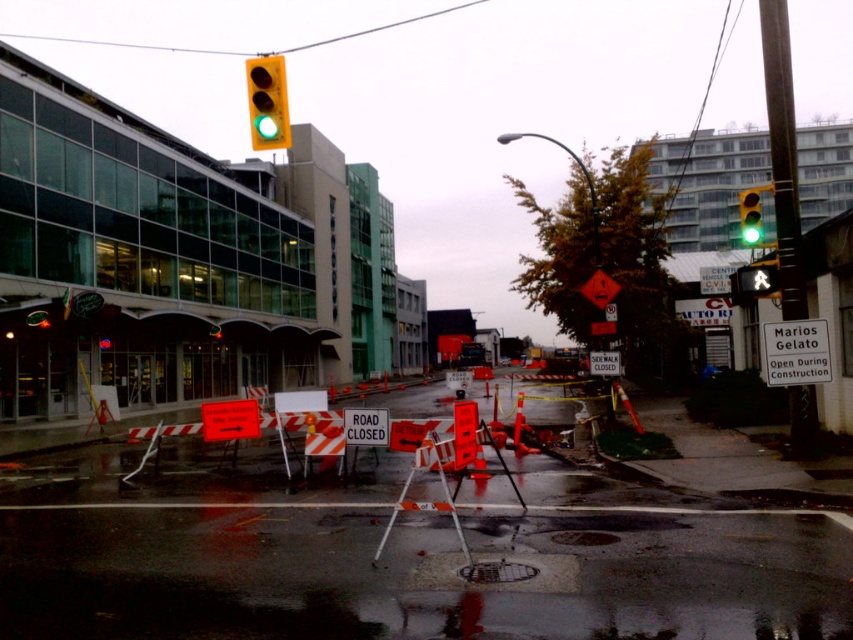
You are a delivery driver who needs to make a left turn at the intersection ahead. You see a green matte traffic light at upper center. Is the point at coordinate (267, 102) on the traffic light?

Yes, the point at coordinate (267, 102) is on the green matte traffic light at upper center.

You are a delivery driver approaching the construction zone and need to navigate around it. Given the presence of the green matte traffic light at upper center and the orange reflective road sign at center, which object would you look up to see first?

The green matte traffic light at upper center is much taller than the orange reflective road sign at center, so you would see the green matte traffic light at upper center first as it is positioned higher in the scene.